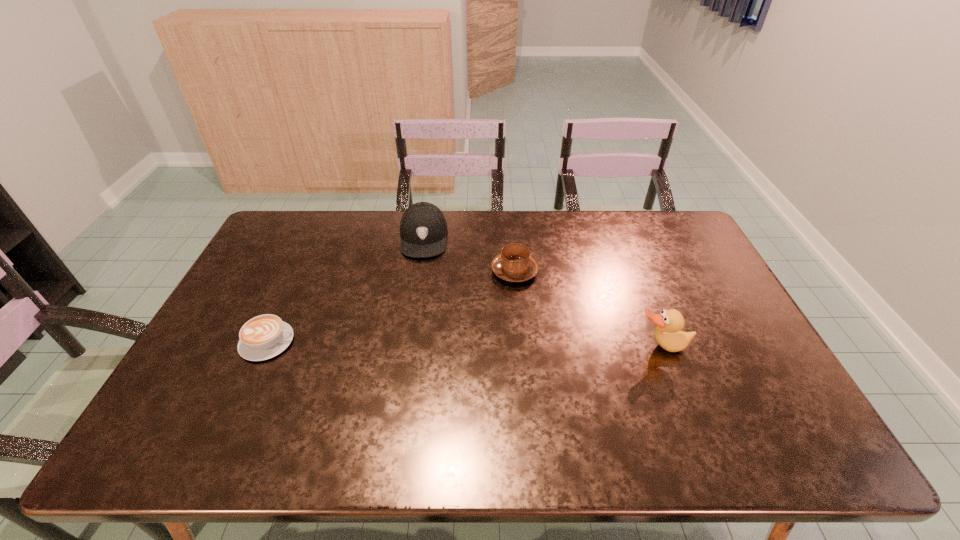
This screenshot has width=960, height=540. Identify the location of free space between the rightmost object and the nearer cappuccino. (465, 344).

Find the location of a particular element. empty space between the rightmost object and the shortest object is located at coordinates (465, 344).

The image size is (960, 540). What are the coordinates of `unoccupied position between the right cappuccino and the third shortest object` in the screenshot? It's located at (469, 254).

You are a GUI agent. You are given a task and a screenshot of the screen. Output one action in this format:
    pyautogui.click(x=<x>, y=<y>)
    Task: Click on the empty space between the shorter cappuccino and the third object from left to right
    
    Given the screenshot: What is the action you would take?
    pyautogui.click(x=392, y=306)

The width and height of the screenshot is (960, 540). Identify the location of free area in between the right cappuccino and the duck. (588, 309).

Find the location of a particular element. This screenshot has height=540, width=960. object that ranks as the third closest to the tallest object is located at coordinates (265, 336).

Identify which object is the nearest to the third object from right to left. Please provide its 2D coordinates. Your answer should be formatted as a tuple, i.e. [(x, y)], where the tuple contains the x and y coordinates of a point satisfying the conditions above.

[(515, 264)]